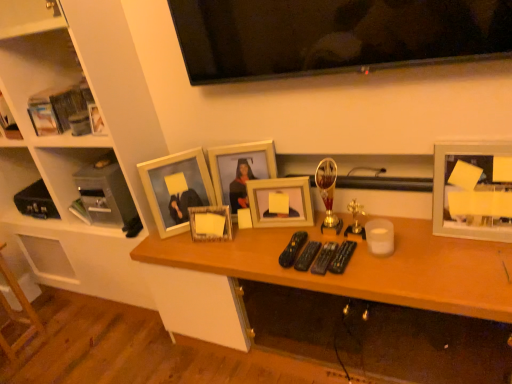
Identify the location of vacant space to the left of wooden picture frame at center, the 4th picture frame in the right-to-left sequence. (x=177, y=244).